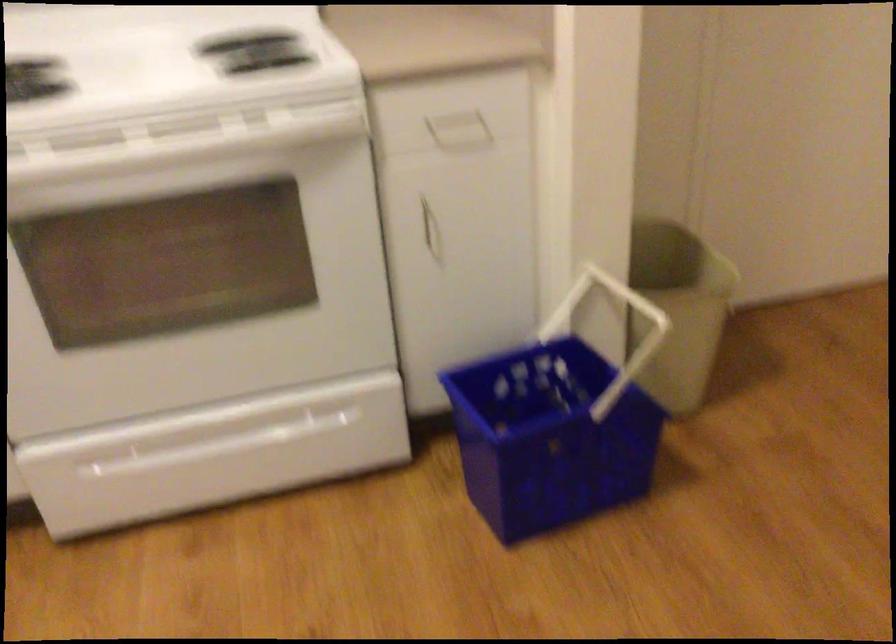
At what (x,y) coordinates should I click in order to perform the action: click on beige trash can. Please return your answer as a coordinate pair (x, y). The width and height of the screenshot is (896, 644). Looking at the image, I should click on (678, 308).